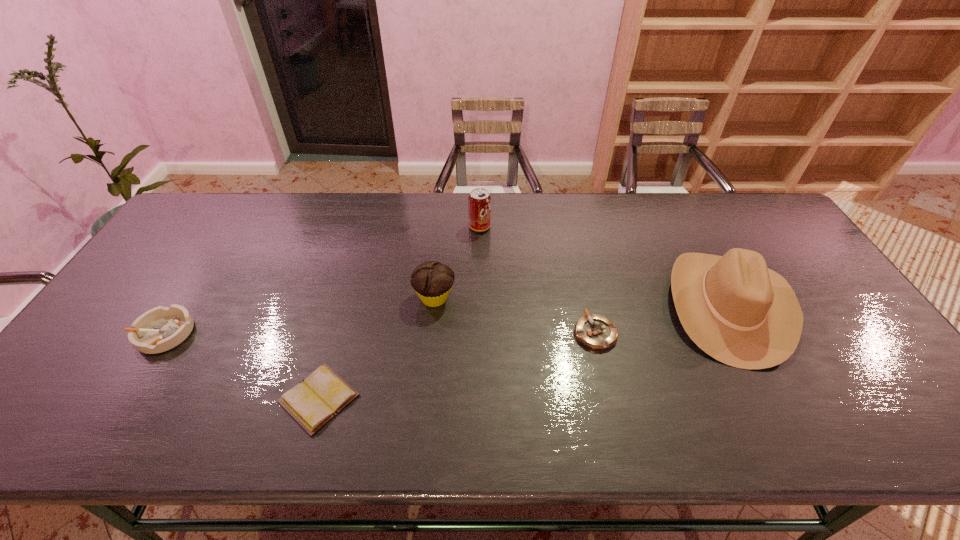
This screenshot has height=540, width=960. Find the location of `free spot between the shortest object and the taller ashtray`. free spot between the shortest object and the taller ashtray is located at coordinates (241, 366).

This screenshot has height=540, width=960. Identify the location of free space between the fifth object from left to right and the fourth tallest object. (379, 333).

Where is `vacant area that lies between the diary and the leftmost object`? This screenshot has height=540, width=960. vacant area that lies between the diary and the leftmost object is located at coordinates (241, 366).

The width and height of the screenshot is (960, 540). Find the location of `vacant area that lies between the leftmost object and the third object from right to left`. vacant area that lies between the leftmost object and the third object from right to left is located at coordinates (322, 280).

Find the location of a particular element. vacant space in between the fourth shortest object and the leftmost object is located at coordinates (300, 315).

Where is `vacant area that lies between the shortest object and the tallest object`? vacant area that lies between the shortest object and the tallest object is located at coordinates pyautogui.click(x=523, y=352).

Identify the location of object that is the fourth closest to the cowboy hat. The width and height of the screenshot is (960, 540). (313, 402).

Locate which object ranks fourth in proximity to the second object from right to left. Please provide its 2D coordinates. Your answer should be formatted as a tuple, i.e. [(x, y)], where the tuple contains the x and y coordinates of a point satisfying the conditions above.

[(313, 402)]

The width and height of the screenshot is (960, 540). Find the location of `vacant area in the image that satisfies the following two spatial constraints: 1. on the front side of the second object from right to left; 2. on the right side of the muffin`. vacant area in the image that satisfies the following two spatial constraints: 1. on the front side of the second object from right to left; 2. on the right side of the muffin is located at coordinates (431, 333).

Where is `free location that satisfies the following two spatial constraints: 1. on the front side of the taller ashtray; 2. on the right side of the second object from left to right`? This screenshot has height=540, width=960. free location that satisfies the following two spatial constraints: 1. on the front side of the taller ashtray; 2. on the right side of the second object from left to right is located at coordinates (123, 399).